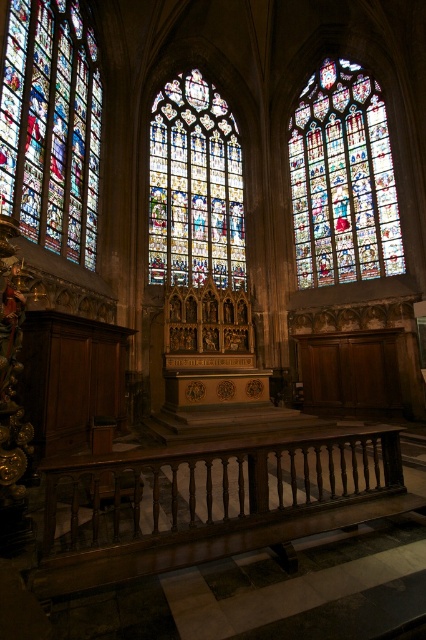
Question: Is dark brown polished wood balustrade at lower center smaller than stained glass window at center?

Choices:
 (A) yes
 (B) no

Answer: (A)

Question: Which of the following is the farthest from the observer?

Choices:
 (A) (347, 256)
 (B) (262, 458)

Answer: (A)

Question: Which of the following is the closest to the observer?

Choices:
 (A) stained glass window at center
 (B) stained glass window at upper right
 (C) stained glass window at left
 (D) dark brown polished wood balustrade at lower center

Answer: (D)

Question: Is dark brown polished wood balustrade at lower center further to the viewer compared to stained glass window at left?

Choices:
 (A) no
 (B) yes

Answer: (A)

Question: Can you confirm if stained glass window at left is positioned above stained glass window at center?

Choices:
 (A) yes
 (B) no

Answer: (B)

Question: Among these points, which one is nearest to the camera?

Choices:
 (A) (262, 500)
 (B) (342, 92)
 (C) (155, 273)

Answer: (A)